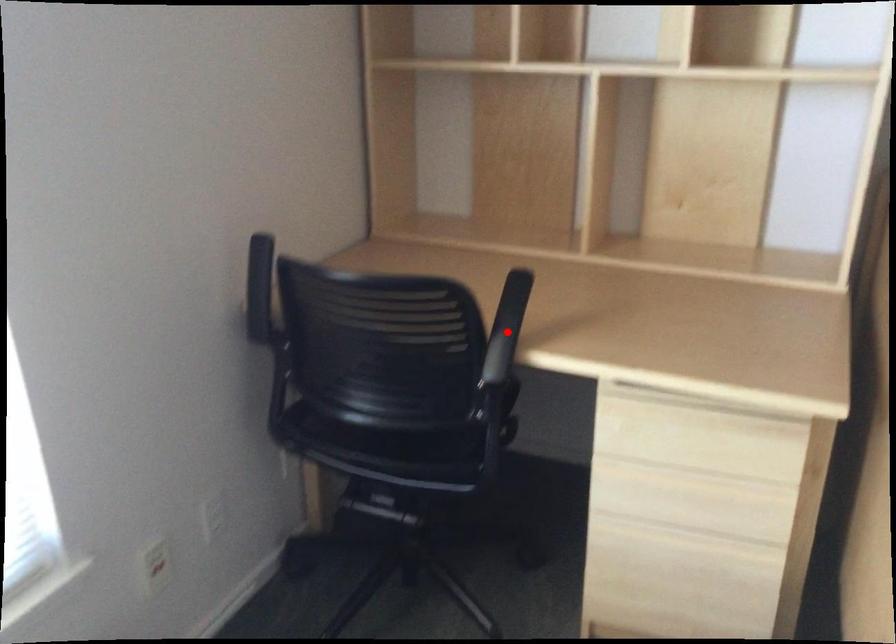
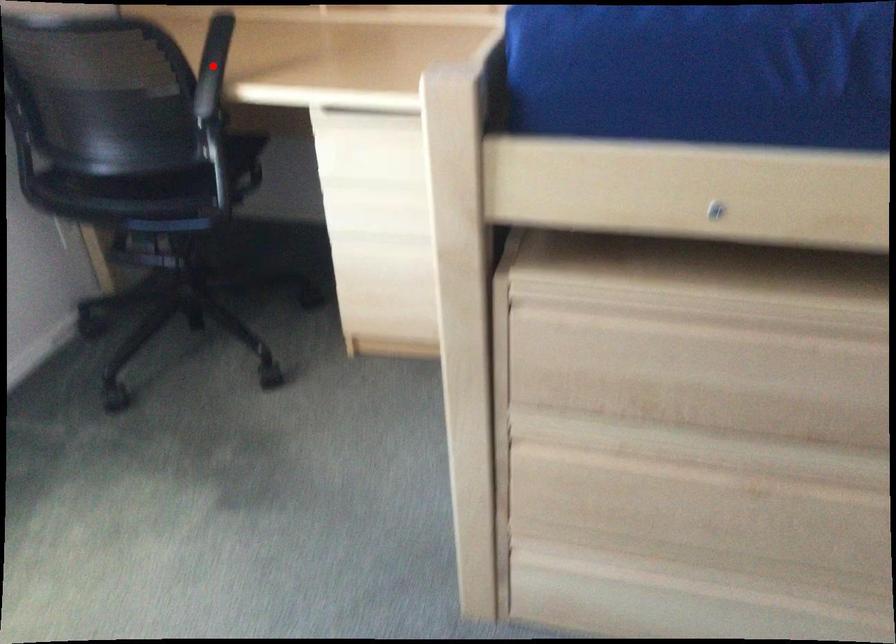
I am providing you with two images of the same scene from different viewpoints. A red point is marked on the first image and another point is marked on the second image. Do the highlighted points in image1 and image2 indicate the same real-world spot?

Yes